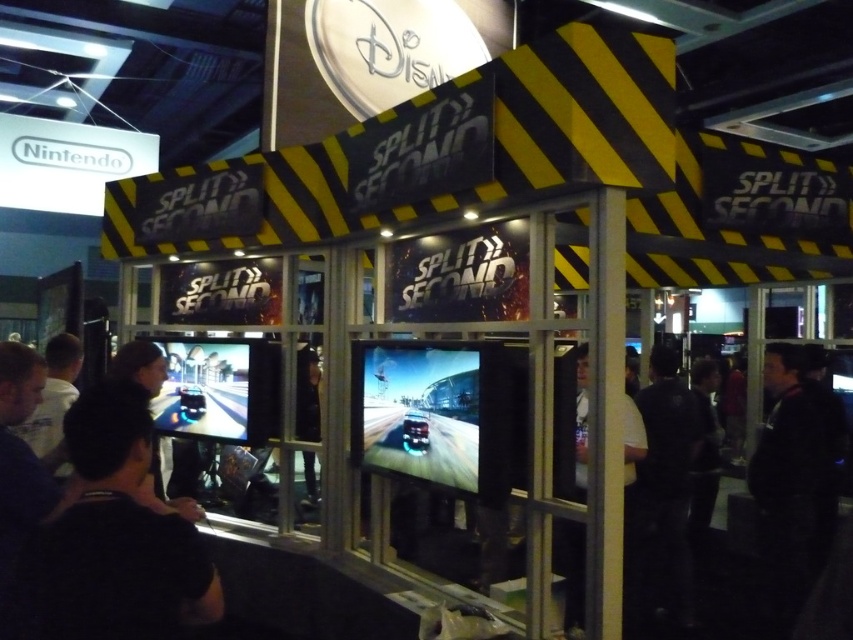
You are a game attendee at the Split Second booth. You notice two black items displayed on a rack. The first is a black matte shirt at lower left and the second is a black fabric jacket at right. Which item is positioned higher on the rack?

The black matte shirt at lower left is located above the black fabric jacket at right, so the black matte shirt at lower left is positioned higher on the rack.

You are standing in front of the gaming booth for Split Second. You notice two points marked on the booth floor. The first point is at coordinates point [674,440] and the second point is at point [30,433]. If you are facing the booth entrance, which point is closer to you?

Point [30,433] is closer to you because it is in front of point [674,440].